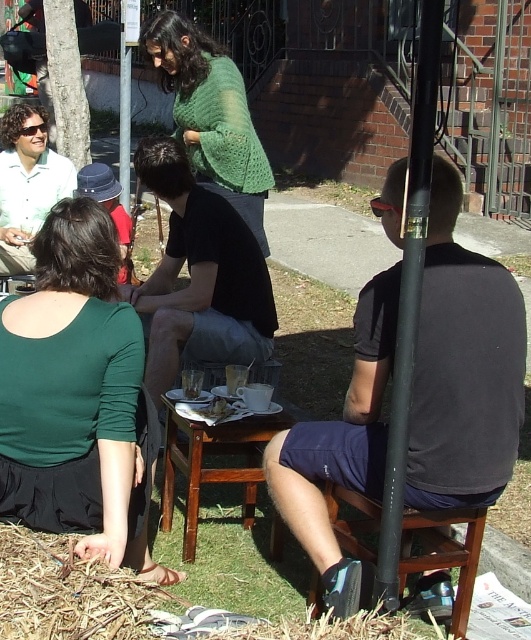
You are standing at the center of the image and want to pick up the brown straw at lower left located at point (x=67, y=593). Which direction should you move to reach it?

The brown straw at lower left is located at point (x=67, y=593), so you should move towards the lower left direction to reach it.

You are a photographer trying to capture a photo of both the green matte shirt at lower left and the green knitted sweater at center. Since you can only focus on one subject at a time, which one should you focus on first to ensure it appears in the foreground of the photo?

You should focus on the green knitted sweater at center first because it is higher up and closer to the camera than the green matte shirt at lower left, which is positioned below it.

You are planning to place a 10 feet long banner between the green knitted sweater at center and the brown straw at lower left. Will the banner fit without overlapping either object?

The distance between the green knitted sweater at center and the brown straw at lower left is 8.41 feet. Since the banner is 10 feet long, it will overlap both objects as it is longer than the space between them.